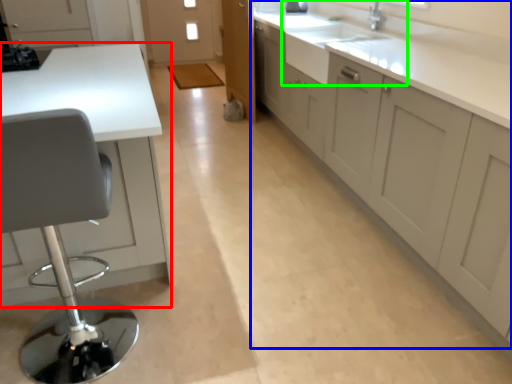
Question: Which object is positioned closest to countertop (highlighted by a red box)? Select from cabinetry (highlighted by a blue box) and sink (highlighted by a green box).

Choices:
 (A) cabinetry
 (B) sink

Answer: (A)